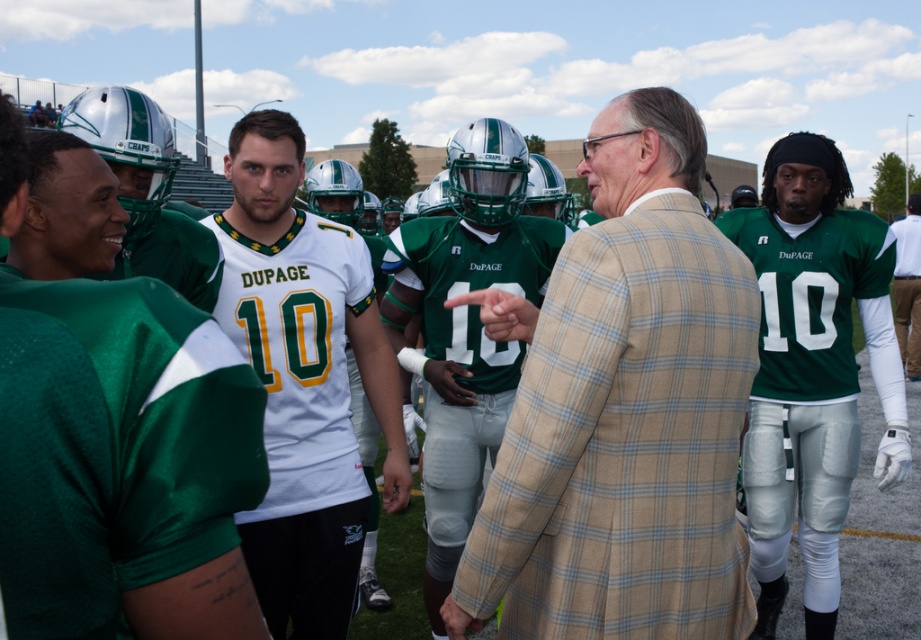
Between beige plaid blazer at center and white mesh jersey at center, which one appears on the right side from the viewer's perspective?

beige plaid blazer at center

Is beige plaid blazer at center to the right of white mesh jersey at center from the viewer's perspective?

Indeed, beige plaid blazer at center is positioned on the right side of white mesh jersey at center.

Describe the element at coordinates (622, 410) in the screenshot. I see `beige plaid blazer at center` at that location.

The height and width of the screenshot is (640, 921). Find the location of `beige plaid blazer at center`. beige plaid blazer at center is located at coordinates (622, 410).

Which is below, white mesh jersey at center or green matte jersey at right?

Positioned lower is green matte jersey at right.

Does point (324, 276) come closer to viewer compared to point (826, 620)?

Yes, it is in front of point (826, 620).

Which is behind, point (357, 339) or point (867, 280)?

The point (867, 280) is behind.

The height and width of the screenshot is (640, 921). Identify the location of white mesh jersey at center. click(x=302, y=380).

From the picture: Which of these two, beige plaid blazer at center or green jersey at center, stands shorter?

Standing shorter between the two is beige plaid blazer at center.

Between point (601, 445) and point (913, 230), which one is positioned behind?

Positioned behind is point (913, 230).

Between point (513, 467) and point (916, 353), which one is positioned behind?

The point (916, 353) is behind.

Image resolution: width=921 pixels, height=640 pixels. Find the location of `beige plaid blazer at center`. beige plaid blazer at center is located at coordinates (622, 410).